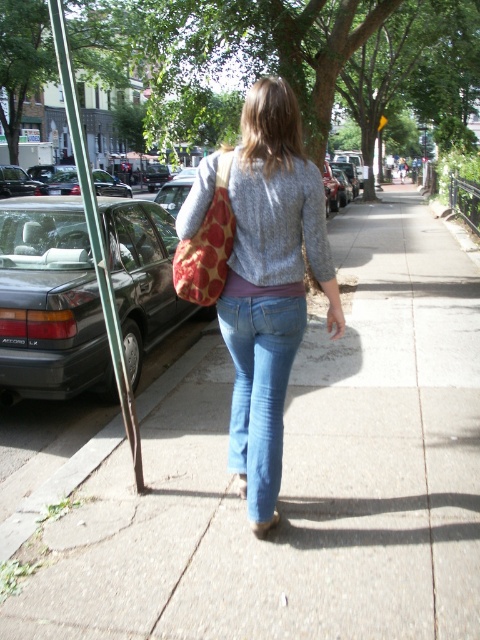
Does denim at center appear on the left side of green wood pole at left?

No, denim at center is not to the left of green wood pole at left.

Who is shorter, denim at center or green wood pole at left?

With less height is denim at center.

Find the location of `denim at center`. denim at center is located at coordinates [260, 388].

Locate an element on the screen. denim at center is located at coordinates (260, 388).

From the picture: Does dark gray metallic sedan at left come behind denim at center?

Yes, dark gray metallic sedan at left is further from the viewer.

Who is taller, dark gray metallic sedan at left or denim at center?

Standing taller between the two is dark gray metallic sedan at left.

Which is in front, point (120, 275) or point (260, 349)?

Point (260, 349) is in front.

Where is `dark gray metallic sedan at left`? dark gray metallic sedan at left is located at coordinates (49, 304).

Between dark gray metallic sedan at left and gray knitted sweater at center, which one is positioned higher?

gray knitted sweater at center

Is point (21, 330) positioned behind point (282, 259)?

Yes, point (21, 330) is farther from viewer.

Where is `dark gray metallic sedan at left`? The height and width of the screenshot is (640, 480). dark gray metallic sedan at left is located at coordinates (49, 304).